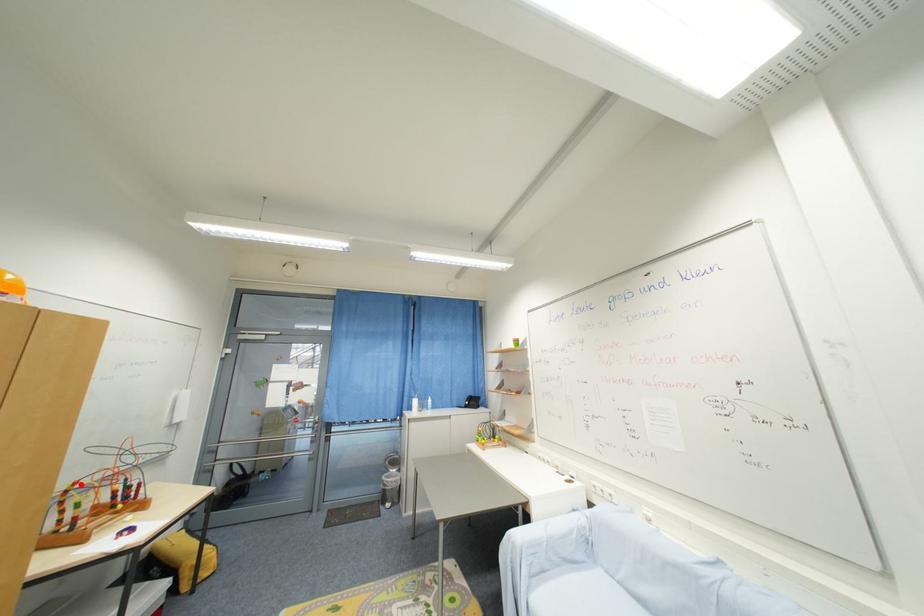
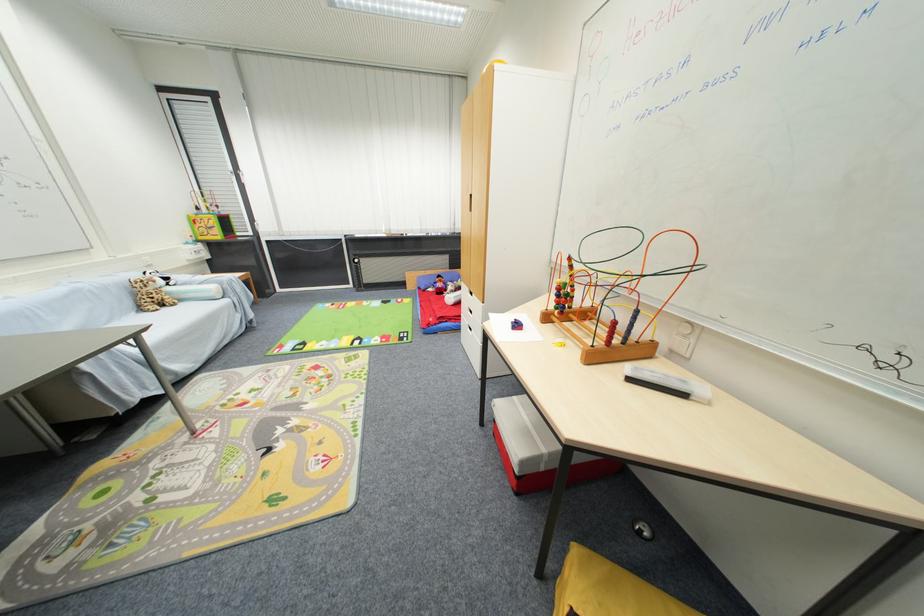
In the second image, find the point that corresponds to the highlighted location in the first image.

(575, 261)